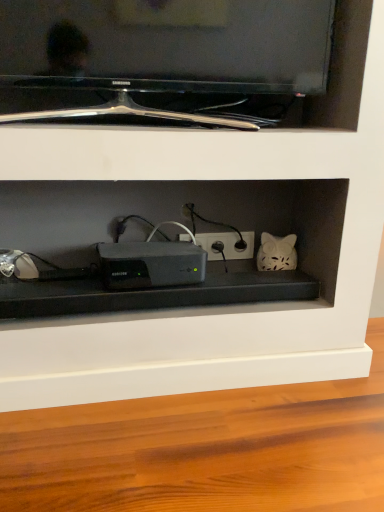
Question: Would you say white plastic electric outlet at center is inside or outside black glossy tv at upper center?

Choices:
 (A) inside
 (B) outside

Answer: (B)

Question: Is white plastic electric outlet at center wider or thinner than black glossy tv at upper center?

Choices:
 (A) thin
 (B) wide

Answer: (A)

Question: Considering the real-world distances, which object is closest to the white plastic electric outlet at center?

Choices:
 (A) sleek black device at center
 (B) black glossy tv at upper center
 (C) white matte cat at center-right

Answer: (C)

Question: Considering the real-world distances, which object is closest to the white plastic electric outlet at center?

Choices:
 (A) black glossy tv at upper center
 (B) sleek black device at center
 (C) white matte cat at center-right

Answer: (C)